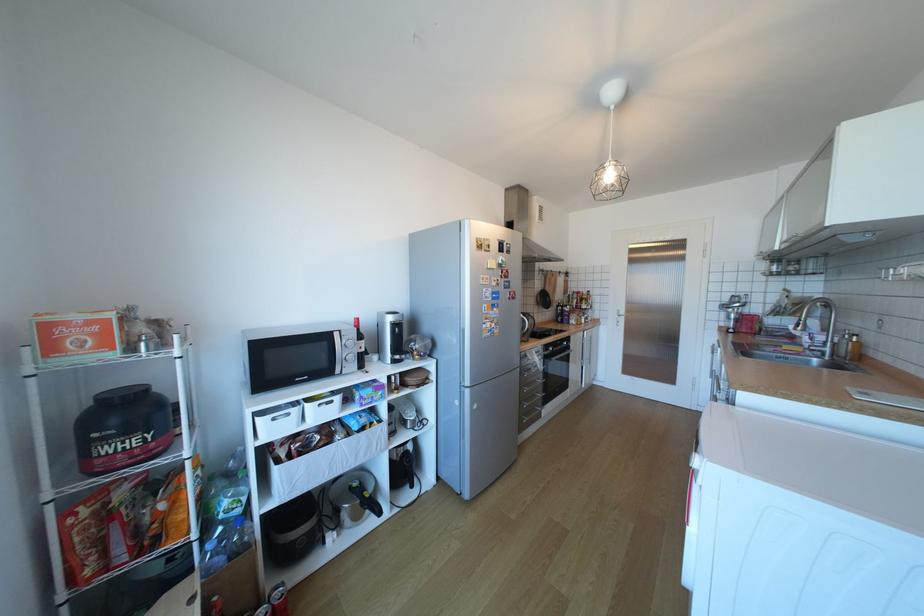
Where would you pull the fourth white cabinet handle from top? Please return your answer as a coordinate pair (x, y).

(533, 400)